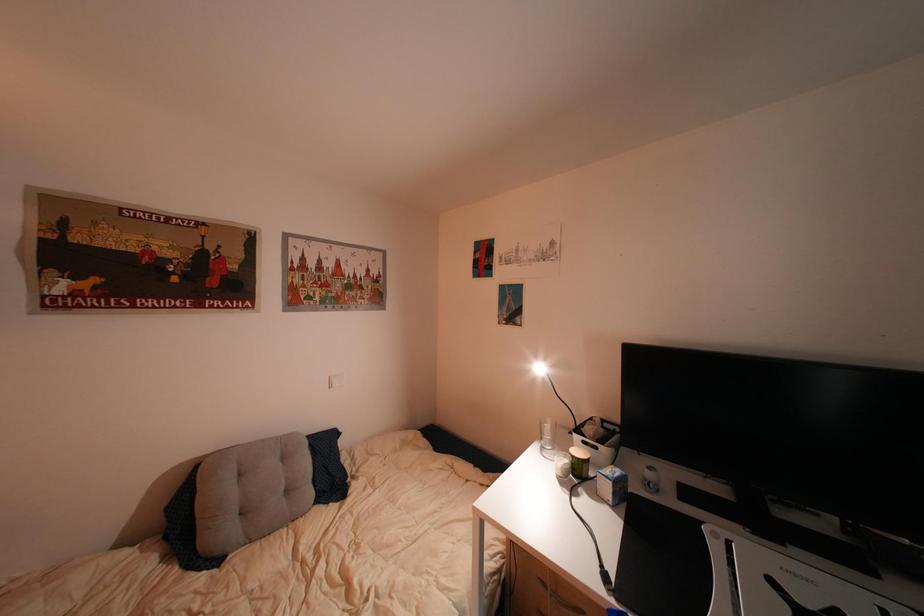
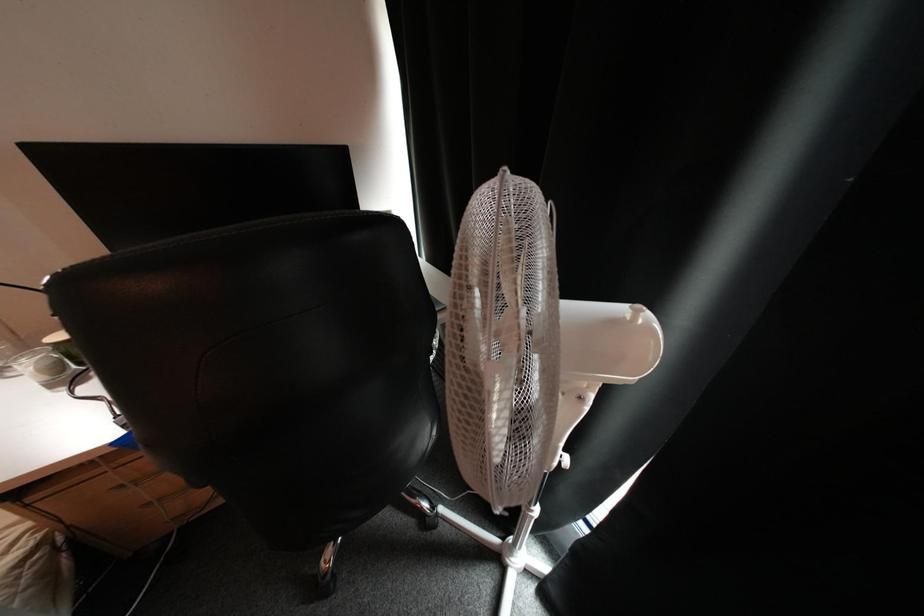
The images are taken continuously from a first-person perspective. In which direction is your viewpoint rotating?

The camera rotated toward right-down.